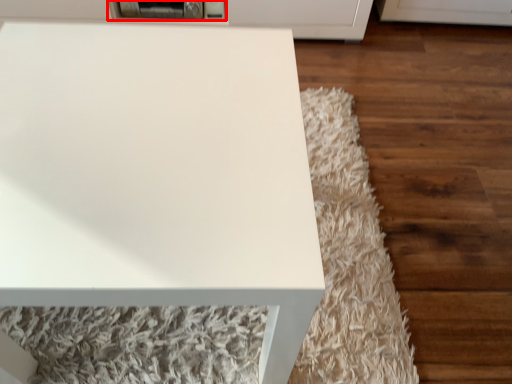
Question: Where is appliance (annotated by the red box) located in relation to table in the image?

Choices:
 (A) left
 (B) right

Answer: (A)